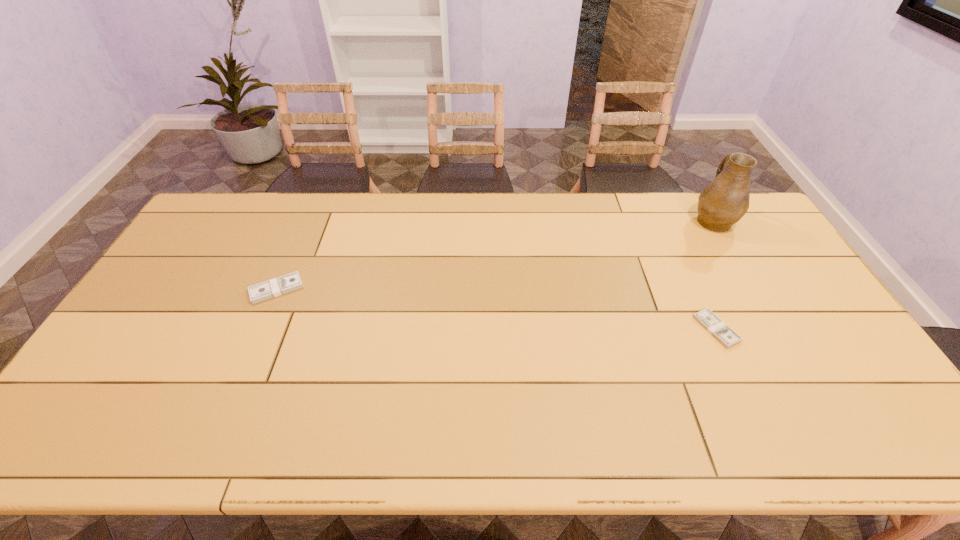
The height and width of the screenshot is (540, 960). I want to click on pitcher, so click(722, 203).

I want to click on the rightmost object, so click(722, 203).

The height and width of the screenshot is (540, 960). Identify the location of the leftmost object. point(281,285).

This screenshot has width=960, height=540. Find the location of `the left dollar`. the left dollar is located at coordinates (281, 285).

At what (x,y) coordinates should I click in order to perform the action: click on the shortest object. Please return your answer as a coordinate pair (x, y). This screenshot has height=540, width=960. Looking at the image, I should click on (716, 327).

Locate an element on the screen. The image size is (960, 540). the right dollar is located at coordinates (716, 327).

Where is `vacant space located 0.270m on the right of the left dollar`? vacant space located 0.270m on the right of the left dollar is located at coordinates (393, 289).

Where is `free space located 0.260m on the back of the shortest object`? The height and width of the screenshot is (540, 960). free space located 0.260m on the back of the shortest object is located at coordinates (679, 249).

Identify the location of object located in the far edge section of the desktop. The image size is (960, 540). (722, 203).

Where is `object present at the right edge`? object present at the right edge is located at coordinates (722, 203).